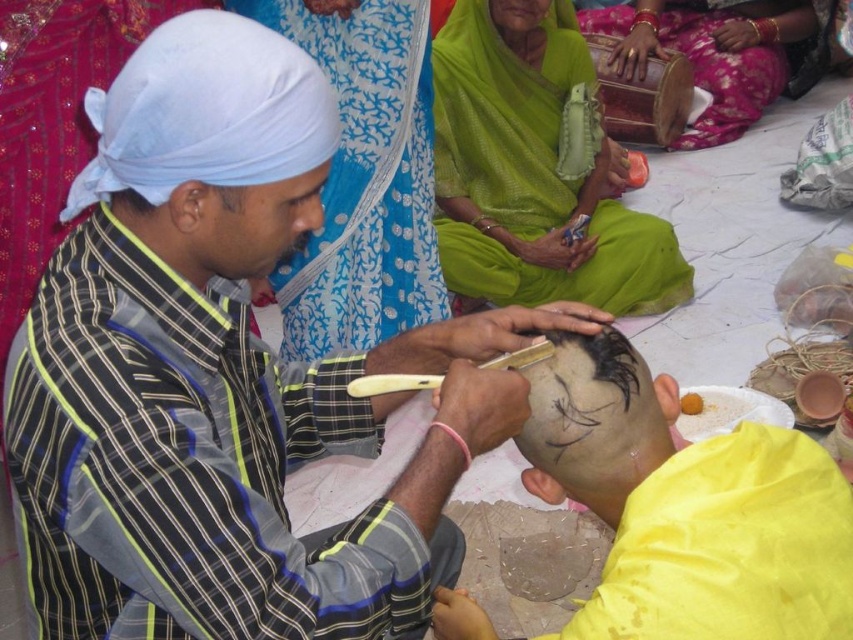
Does point (515, 225) come in front of point (573, 433)?

No, it is behind (573, 433).

From the picture: Does green silk saree at upper center have a greater width compared to black hair at center?

Correct, the width of green silk saree at upper center exceeds that of black hair at center.

At what (x,y) coordinates should I click in order to perform the action: click on green silk saree at upper center. Please return your answer as a coordinate pair (x, y). Looking at the image, I should click on (537, 173).

This screenshot has height=640, width=853. Find the location of `matte clay mask at center`. matte clay mask at center is located at coordinates pos(703,518).

Consider the image. Who is higher up, matte clay mask at center or wooden drum at upper right?

Positioned higher is wooden drum at upper right.

At what (x,y) coordinates should I click in order to perform the action: click on matte clay mask at center. Please return your answer as a coordinate pair (x, y). The width and height of the screenshot is (853, 640). Looking at the image, I should click on (703, 518).

Which of these two, green silk saree at upper center or smooth green fabric at center, stands shorter?

smooth green fabric at center is shorter.

Is point (450, 200) less distant than point (524, 33)?

No, (450, 200) is behind (524, 33).

Who is more forward, (560, 35) or (506, 20)?

Point (506, 20) is in front.

This screenshot has height=640, width=853. Identify the location of green silk saree at upper center. (537, 173).